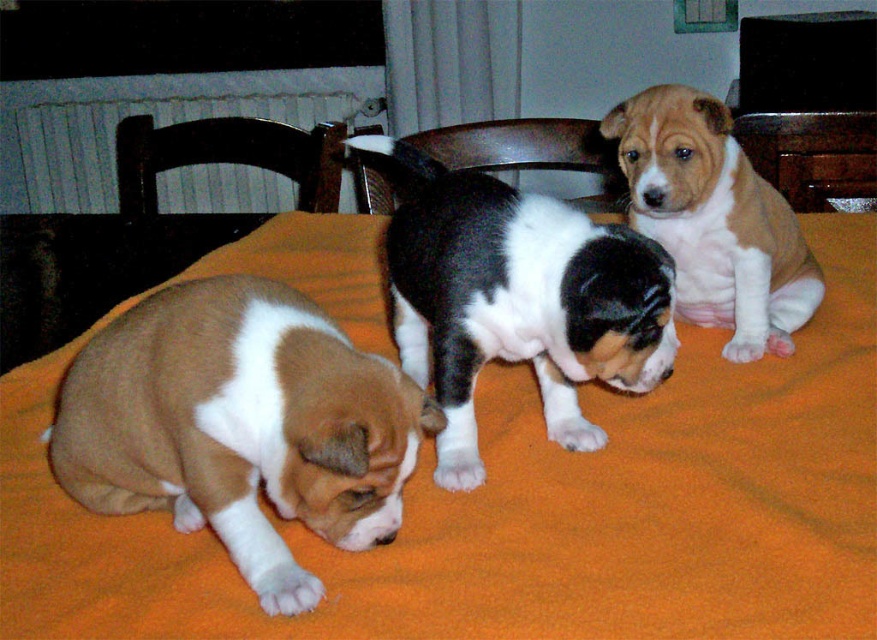
Does black and white fur at center appear on the right side of brown and white fur puppy at upper right?

In fact, black and white fur at center is to the left of brown and white fur puppy at upper right.

Between point (572, 291) and point (712, 129), which one is positioned in front?

Positioned in front is point (572, 291).

Does point (447, 372) lie behind point (631, 198)?

No, it is not.

The height and width of the screenshot is (640, 877). Find the location of `black and white fur at center`. black and white fur at center is located at coordinates (517, 300).

Does brown and white fur puppy at upper right have a greater height compared to wooden chair at center?

Incorrect, brown and white fur puppy at upper right's height is not larger of wooden chair at center's.

Does point (756, 317) lie in front of point (386, 168)?

Yes, point (756, 317) is in front of point (386, 168).

Locate an element on the screen. The image size is (877, 640). brown and white fur puppy at upper right is located at coordinates (714, 220).

Who is taller, orange fleece blanket at center or dark wood chair at upper left?

With more height is orange fleece blanket at center.

Is orange fleece blanket at center bigger than dark wood chair at upper left?

Yes.

Measure the distance between orange fleece blanket at center and camera.

They are 43.40 centimeters apart.

Locate an element on the screen. The image size is (877, 640). orange fleece blanket at center is located at coordinates (529, 512).